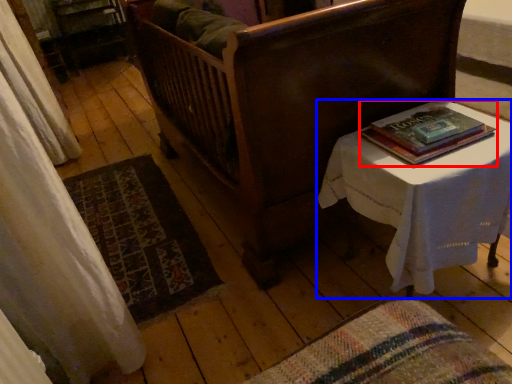
Question: Which object appears closest to the camera in this image, book (highlighted by a red box) or table (highlighted by a blue box)?

Choices:
 (A) book
 (B) table

Answer: (B)